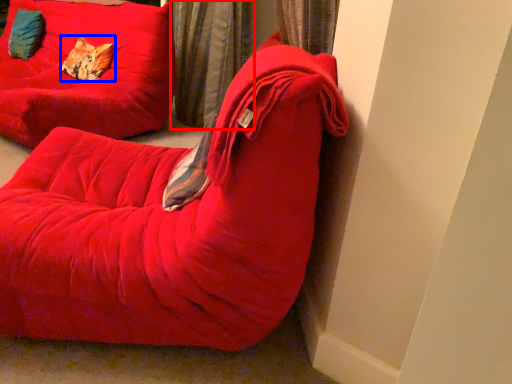
Question: Which object is closer to the camera taking this photo, curtain (highlighted by a red box) or pillow (highlighted by a blue box)?

Choices:
 (A) curtain
 (B) pillow

Answer: (A)